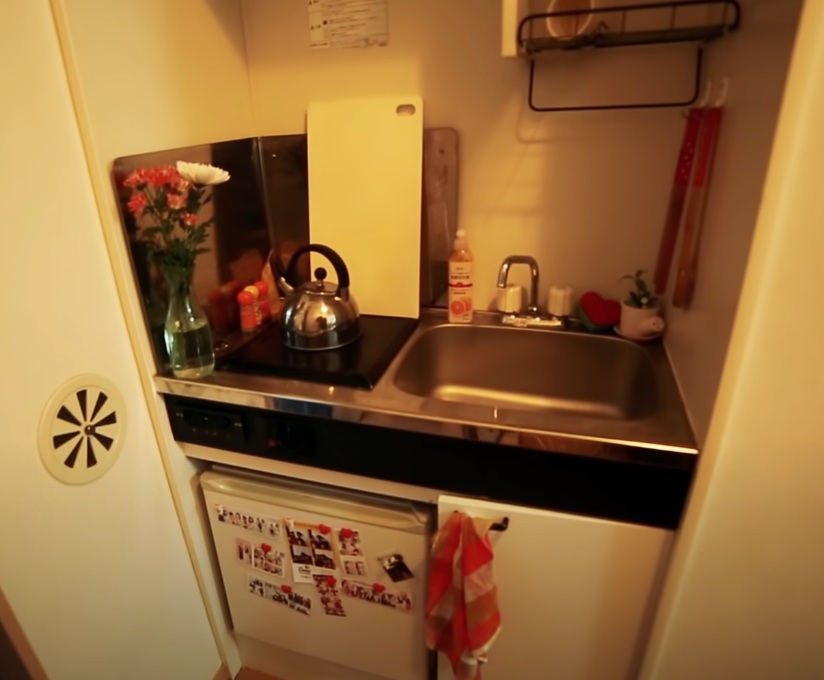
I want to click on drying rack, so click(654, 33).